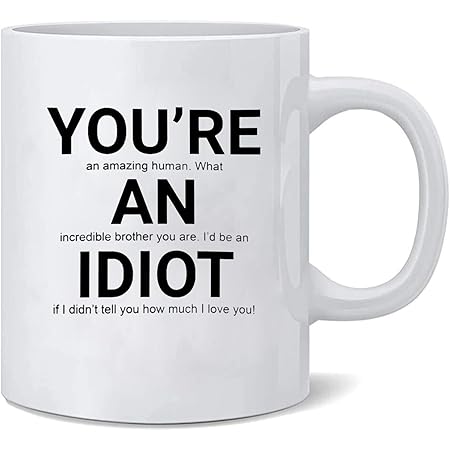
Find the location of a particular element. reflection of the handle is located at coordinates (291, 301), (283, 98).